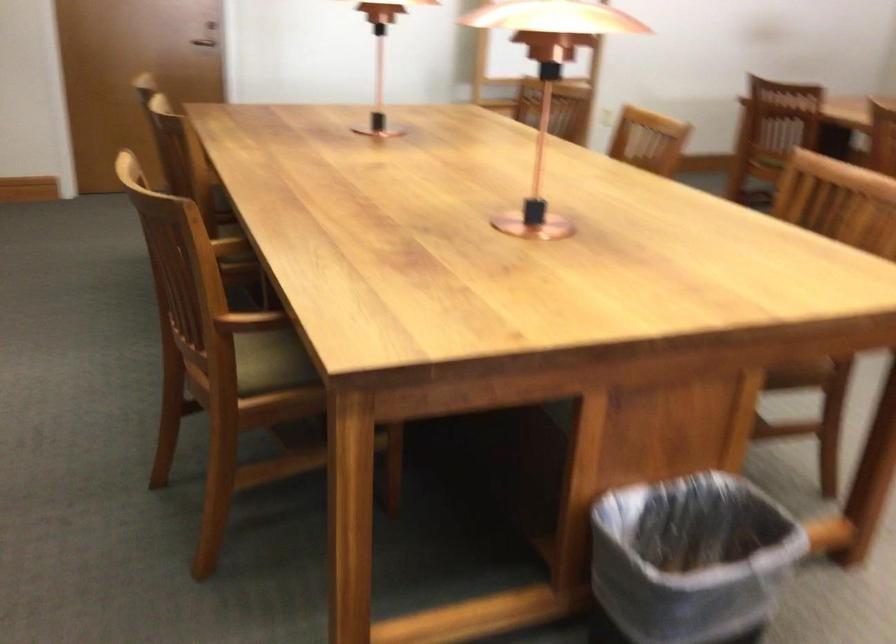
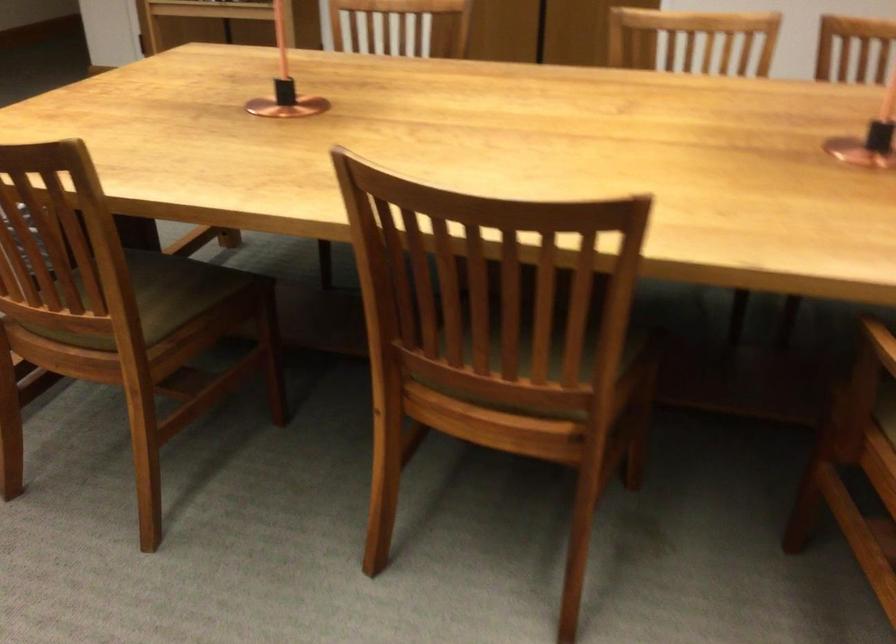
Question: I am providing you with two images of the same scene from different viewpoints. Which of the following objects are not visible in image2?

Choices:
 (A) copper table object
 (B) green chair sitting surface
 (C) chair sitting surface
 (D) black plastic bucket

Answer: (C)